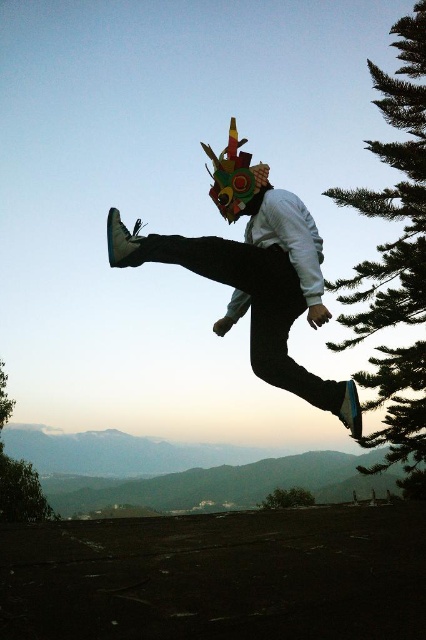
You are standing in the scene and want to take a photo of the person performing the high kick. The green textured pine tree at right is in your way. Can you move to the side to avoid it?

The green textured pine tree at right is 7.99 meters away from viewer, so you can move to the side to avoid it since it is far enough away to maneuver around.

You are an artist planning to paint the scene. You need to place the green textured pine tree at right and the green matte tree at lower center in your painting. According to the scene, which tree should be placed to the right of the other?

The green textured pine tree at right is positioned on the right side of the green matte tree at lower center, so the green textured pine tree at right should be placed to the right of the green matte tree at lower center.

You are an artist planning to paint a landscape inspired by this scene. You want to ensure the green leafy tree at lower left and the green matte tree at lower center are proportionally accurate. Which tree should you make larger in your painting?

The green leafy tree at lower left should be painted larger than the green matte tree at lower center because it is described as larger in size.